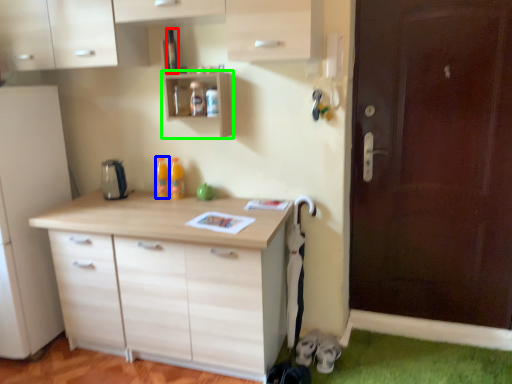
Question: Which object is positioned farthest from bottle (highlighted by a red box)? Select from bottle (highlighted by a blue box) and shelf (highlighted by a green box).

Choices:
 (A) bottle
 (B) shelf

Answer: (A)